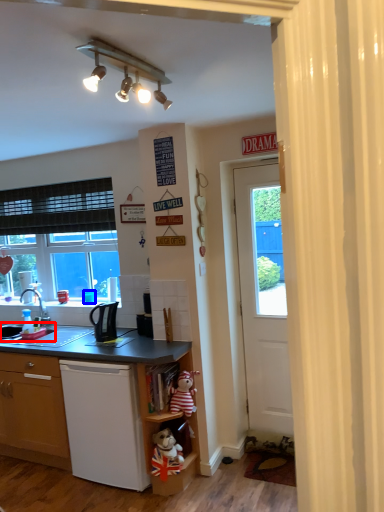
Question: Which of the following is the closest to the observer, sink (highlighted by a red box) or coffee cup (highlighted by a blue box)?

Choices:
 (A) sink
 (B) coffee cup

Answer: (A)